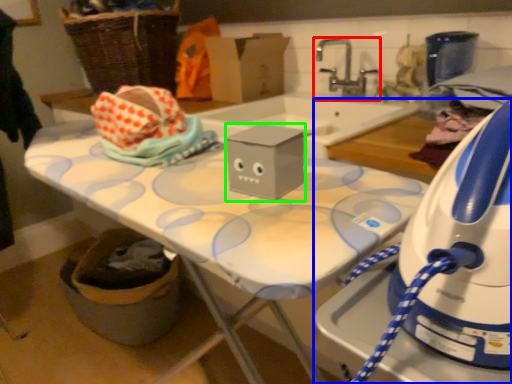
Question: Estimate the real-world distances between objects in this image. Which object is farther from tap (highlighted by a red box), home appliance (highlighted by a blue box) or box (highlighted by a green box)?

Choices:
 (A) home appliance
 (B) box

Answer: (A)